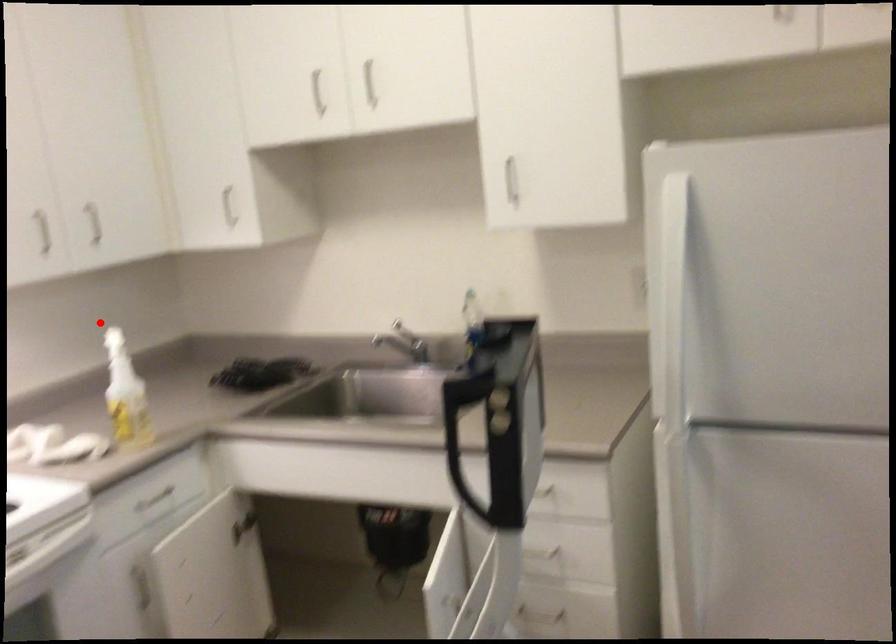
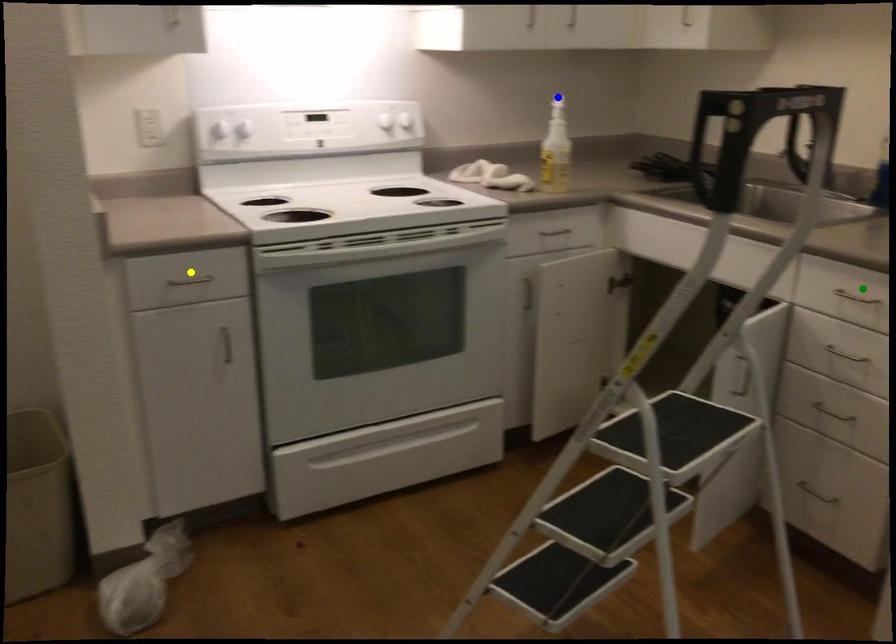
Question: I am providing you with two images of the same scene from different viewpoints. A red point is marked on the first image. You are given multiple points on the second image. Which spot in image 2 lines up with the point in image 1?

Choices:
 (A) yellow point
 (B) green point
 (C) blue point

Answer: (C)